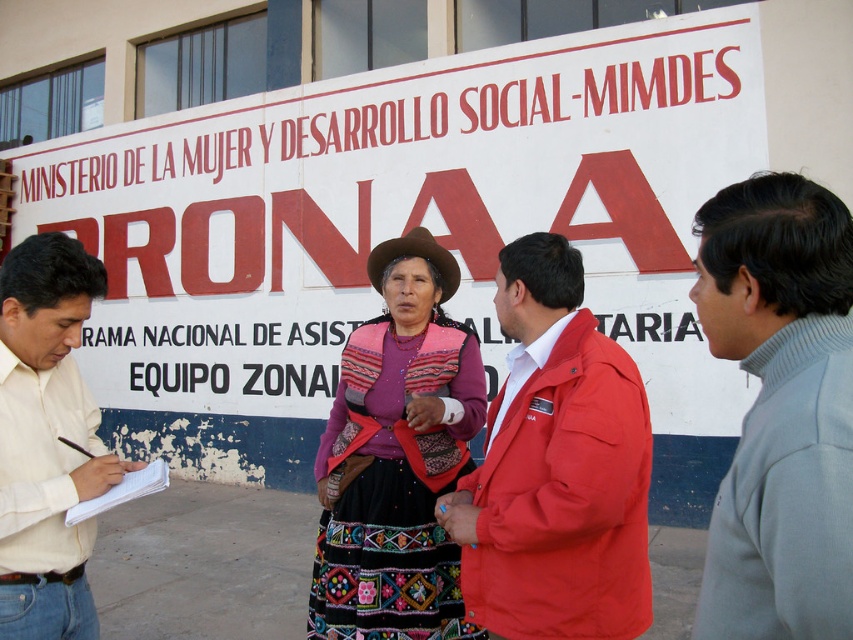
Can you confirm if white paperboard sign at center is positioned above light yellow shirt at left?

Yes, white paperboard sign at center is above light yellow shirt at left.

The image size is (853, 640). Describe the element at coordinates (396, 227) in the screenshot. I see `white paperboard sign at center` at that location.

This screenshot has width=853, height=640. Describe the element at coordinates (396, 227) in the screenshot. I see `white paperboard sign at center` at that location.

I want to click on white paperboard sign at center, so click(x=396, y=227).

Between white paperboard sign at center and brown felt cowboy hat at center, which one has more height?

Standing taller between the two is brown felt cowboy hat at center.

Identify the location of white paperboard sign at center. Image resolution: width=853 pixels, height=640 pixels. (396, 227).

Which is behind, point (688, 502) or point (428, 234)?

Point (688, 502)

Locate an element on the screen. This screenshot has height=640, width=853. white paperboard sign at center is located at coordinates (396, 227).

Is point (425, 380) closer to viewer compared to point (437, 273)?

Yes, it is in front of point (437, 273).

Who is more forward, (387, 496) or (434, 240)?

Point (387, 496)

This screenshot has width=853, height=640. Find the location of `embroidered fabric dress at center`. embroidered fabric dress at center is located at coordinates (396, 458).